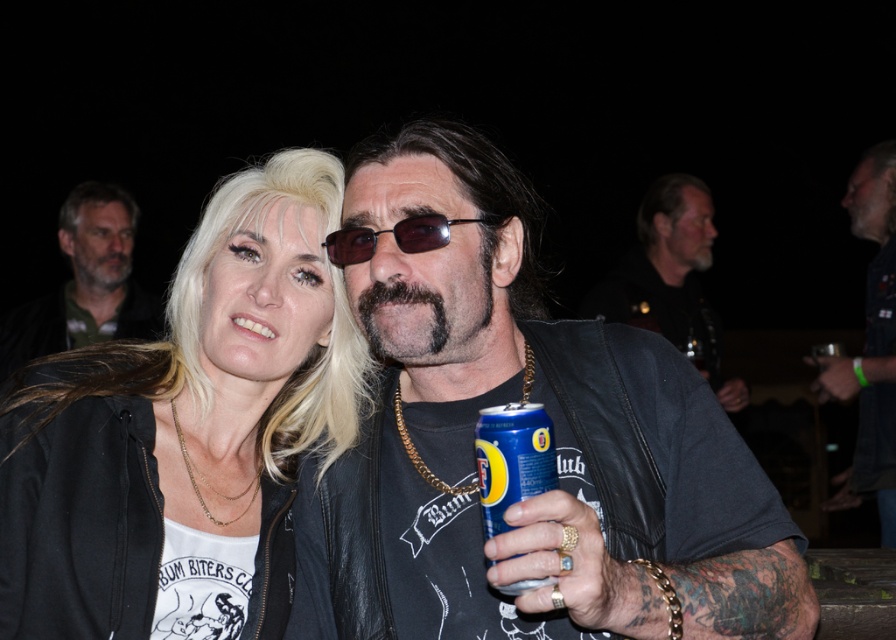
Can you confirm if blue metallic can at center is bigger than sunglasses at center?

Yes.

The image size is (896, 640). Describe the element at coordinates (513, 460) in the screenshot. I see `blue metallic can at center` at that location.

Locate an element on the screen. blue metallic can at center is located at coordinates (513, 460).

Which is more to the left, blonde hair at center or dark brown leather jacket at right?

Positioned to the left is blonde hair at center.

Which is in front, point (294, 202) or point (866, 442)?

Point (294, 202) is in front.

Where is `blonde hair at center`? Image resolution: width=896 pixels, height=640 pixels. blonde hair at center is located at coordinates (184, 429).

Is leather jacket at center positioned before blonde hair at center?

Yes, leather jacket at center is in front of blonde hair at center.

Who is more forward, (665, 520) or (360, 369)?

Point (665, 520) is in front.

Identify the location of leather jacket at center. This screenshot has width=896, height=640. (557, 435).